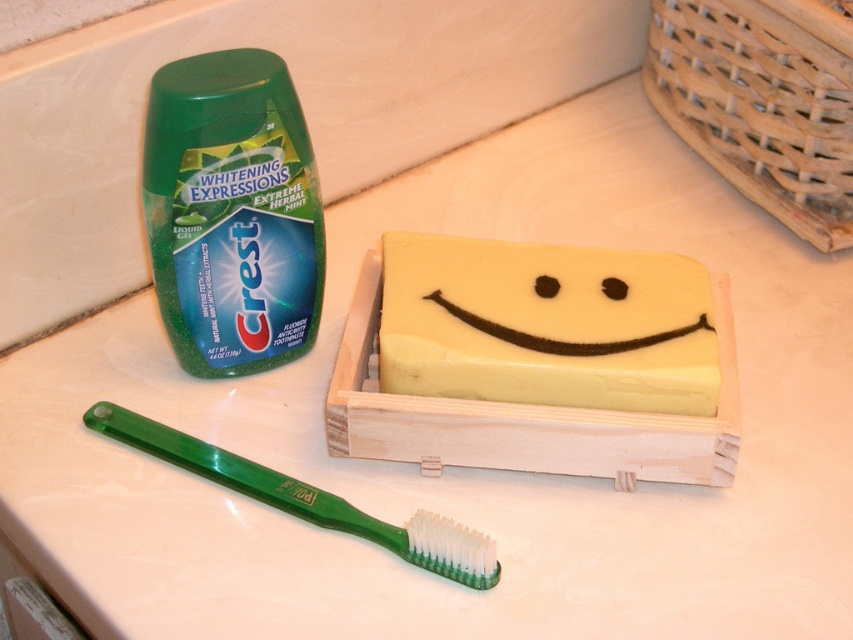
You are organizing the bathroom items and need to place the green glossy toothpaste tube at upper left and the green plastic toothbrush at lower left into a drawer. The drawer has a width of 10 cm. If the toothbrush is wider than the toothpaste tube, will both items fit side by side in the drawer?

The green glossy toothpaste tube at upper left has a lesser width compared to the green plastic toothbrush at lower left. Since the toothbrush is wider, the combined width of both items may exceed the drawer width of 10 cm. It depends on their exact dimensions, but there is a possibility they won

You are organizing the bathroom items. You need to move the green plastic toothbrush at lower left and the yellow translucent soap at center to a shelf above. Which item should you move first if you want to avoid blocking access to the other?

You should move the green plastic toothbrush at lower left first because it is behind the yellow translucent soap at center. Moving it first will prevent blocking access to the soap when moving the latter.